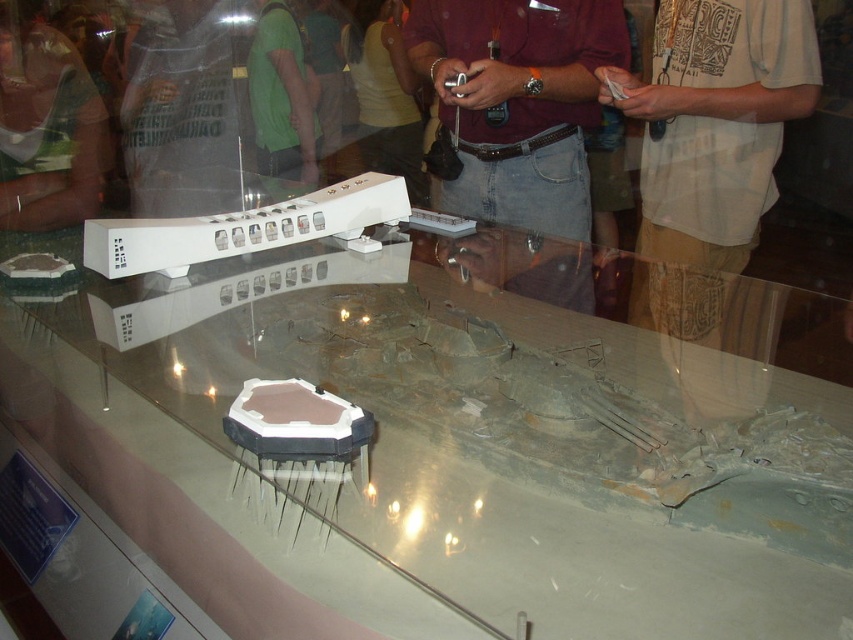
Question: Where is transparent glass table at center located in relation to maroon shirt at center in the image?

Choices:
 (A) above
 (B) below

Answer: (B)

Question: Which of the following is the farthest from the observer?

Choices:
 (A) transparent glass table at center
 (B) maroon shirt at center

Answer: (B)

Question: Can you confirm if transparent glass table at center is positioned below maroon shirt at center?

Choices:
 (A) no
 (B) yes

Answer: (B)

Question: Is transparent glass table at center wider than maroon shirt at center?

Choices:
 (A) no
 (B) yes

Answer: (B)